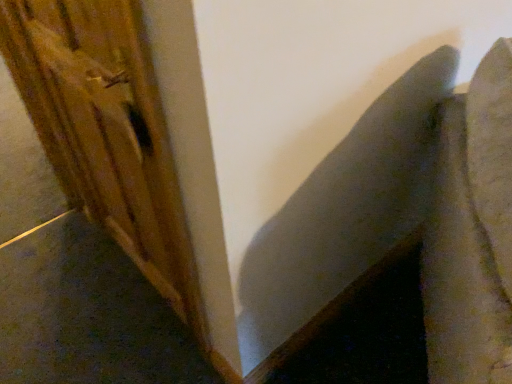
What do you see at coordinates (472, 233) in the screenshot? The height and width of the screenshot is (384, 512). I see `textured gray cushion at upper right` at bounding box center [472, 233].

What is the approximate height of textured gray cushion at upper right?

The height of textured gray cushion at upper right is 37.78 inches.

Identify the location of textured gray cushion at upper right. (472, 233).

At what (x,y) coordinates should I click in order to perform the action: click on wooden plank at left. Please return your answer as a coordinate pair (x, y). The image size is (512, 384). Looking at the image, I should click on [x=106, y=131].

Describe the element at coordinates (106, 131) in the screenshot. Image resolution: width=512 pixels, height=384 pixels. I see `wooden plank at left` at that location.

Measure the distance between wooden plank at left and camera.

wooden plank at left and camera are 69.23 centimeters apart.

This screenshot has height=384, width=512. I want to click on textured gray cushion at upper right, so 472,233.

Consider the image. Between wooden plank at left and textured gray cushion at upper right, which one appears on the left side from the viewer's perspective?

wooden plank at left is more to the left.

Which object is more forward, wooden plank at left or textured gray cushion at upper right?

Positioned in front is textured gray cushion at upper right.

Which is behind, point (91, 39) or point (486, 303)?

Point (91, 39)

From the image's perspective, is wooden plank at left on textured gray cushion at upper right?

Correct, wooden plank at left appears higher than textured gray cushion at upper right in the image.

From a real-world perspective, is wooden plank at left positioned over textured gray cushion at upper right based on gravity?

Yes, from a real-world perspective, wooden plank at left is above textured gray cushion at upper right.

Between wooden plank at left and textured gray cushion at upper right, which one has smaller width?

wooden plank at left.

Does wooden plank at left have a lesser height compared to textured gray cushion at upper right?

No.

Considering the sizes of objects wooden plank at left and textured gray cushion at upper right in the image provided, who is bigger, wooden plank at left or textured gray cushion at upper right?

Bigger between the two is textured gray cushion at upper right.

Is textured gray cushion at upper right surrounded by wooden plank at left?

No.

Is wooden plank at left directly adjacent to textured gray cushion at upper right?

No, wooden plank at left is not touching textured gray cushion at upper right.

Is wooden plank at left looking in the opposite direction of textured gray cushion at upper right?

No, wooden plank at left is not facing the opposite direction of textured gray cushion at upper right.

How much distance is there between wooden plank at left and textured gray cushion at upper right?

wooden plank at left is 34.45 inches from textured gray cushion at upper right.

The width and height of the screenshot is (512, 384). What are the coordinates of `barn door behind the textured gray cushion at upper right` in the screenshot? It's located at (106, 131).

In the image, is textured gray cushion at upper right on the left side or the right side of wooden plank at left?

In the image, textured gray cushion at upper right appears on the right side of wooden plank at left.

Considering their positions, is textured gray cushion at upper right located in front of or behind wooden plank at left?

textured gray cushion at upper right is positioned closer to the viewer than wooden plank at left.

Does point (501, 212) appear closer or farther from the camera than point (125, 212)?

Point (501, 212) appears to be closer to the viewer than point (125, 212).

From the image's perspective, relative to wooden plank at left, is textured gray cushion at upper right above or below?

textured gray cushion at upper right is below wooden plank at left.

From a real-world perspective, does textured gray cushion at upper right stand above wooden plank at left?

Actually, textured gray cushion at upper right is physically below wooden plank at left in the real world.

Consider the image. Considering the sizes of objects textured gray cushion at upper right and wooden plank at left in the image provided, who is wider, textured gray cushion at upper right or wooden plank at left?

textured gray cushion at upper right.

Is textured gray cushion at upper right shorter than wooden plank at left?

Yes, textured gray cushion at upper right is shorter than wooden plank at left.

Considering the sizes of objects textured gray cushion at upper right and wooden plank at left in the image provided, who is bigger, textured gray cushion at upper right or wooden plank at left?

With larger size is textured gray cushion at upper right.

Does textured gray cushion at upper right contain wooden plank at left?

No.

Is textured gray cushion at upper right far away from wooden plank at left?

textured gray cushion at upper right is near wooden plank at left, not far away.

Could you tell me if textured gray cushion at upper right is facing wooden plank at left?

No, textured gray cushion at upper right is not aimed at wooden plank at left.

How different are the orientations of textured gray cushion at upper right and wooden plank at left in degrees?

The facing directions of textured gray cushion at upper right and wooden plank at left are 127 degrees apart.

At what (x,y) coordinates should I click in order to perform the action: click on barn door to the left of textured gray cushion at upper right. Please return your answer as a coordinate pair (x, y). Image resolution: width=512 pixels, height=384 pixels. Looking at the image, I should click on (106, 131).

This screenshot has height=384, width=512. I want to click on swivel chair beneath the wooden plank at left (from a real-world perspective), so click(472, 233).

The height and width of the screenshot is (384, 512). I want to click on swivel chair in front of the wooden plank at left, so click(x=472, y=233).